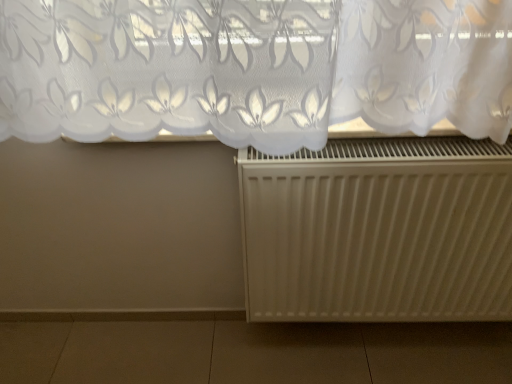
Describe the element at coordinates (379, 231) in the screenshot. I see `white matte radiator at lower right` at that location.

Where is `white matte radiator at lower right`? The image size is (512, 384). white matte radiator at lower right is located at coordinates (x=379, y=231).

Measure the distance between white matte radiator at lower right and camera.

white matte radiator at lower right is 36.99 inches from camera.

Locate an element on the screen. This screenshot has height=384, width=512. white matte radiator at lower right is located at coordinates (379, 231).